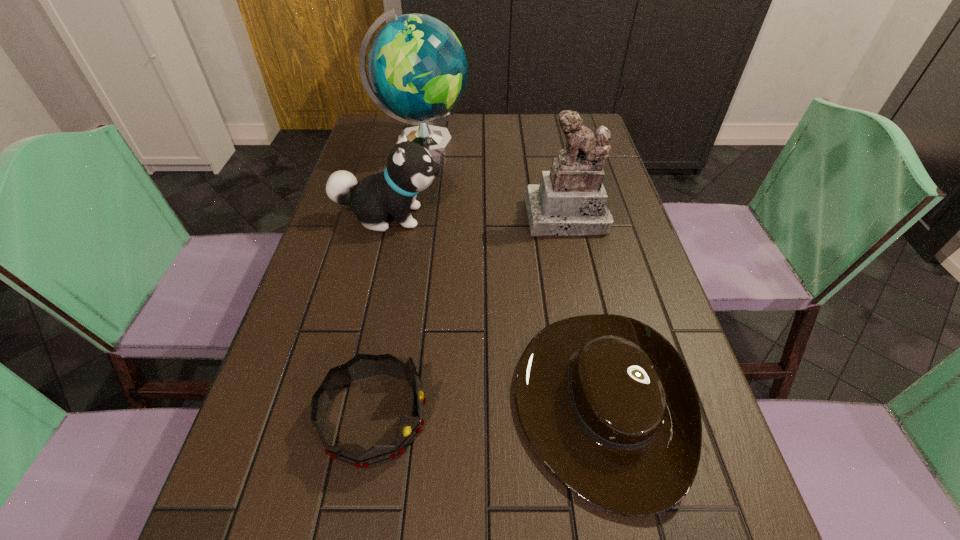
In order to click on object identified as the fourth closest to the globe in this screenshot , I will do `click(361, 366)`.

This screenshot has width=960, height=540. Identify the location of vacant position in the image that satisfies the following two spatial constraints: 1. at the face of the third tallest object; 2. on the back side of the shortest object. (348, 402).

Where is `free location that satisfies the following two spatial constraints: 1. on the front surface of the globe; 2. on the back side of the shortest object`? The image size is (960, 540). free location that satisfies the following two spatial constraints: 1. on the front surface of the globe; 2. on the back side of the shortest object is located at coordinates tap(374, 402).